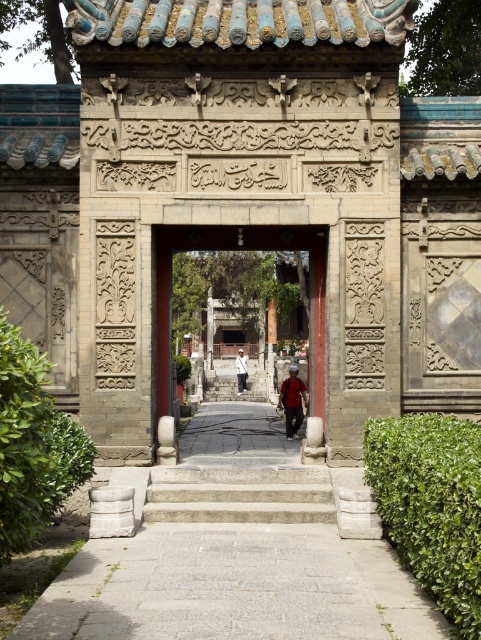
Who is positioned more to the left, green leafy hedge at right or smooth stone gate at center?

smooth stone gate at center

Based on the photo, which is above, green leafy hedge at right or smooth stone gate at center?

smooth stone gate at center is above.

Who is more distant from viewer, (463, 445) or (156, 364)?

Positioned behind is point (156, 364).

You are a GUI agent. You are given a task and a screenshot of the screen. Output one action in this format:
    pyautogui.click(x=<x>, y=<y>)
    Task: Click on the green leafy hedge at right
    The height and width of the screenshot is (640, 481).
    Given the screenshot: What is the action you would take?
    pyautogui.click(x=431, y=506)

Is the position of green leafy hedge at right less distant than that of gray stone stairs at center?

Yes, it is in front of gray stone stairs at center.

Can you confirm if green leafy hedge at right is shorter than gray stone stairs at center?

Indeed, green leafy hedge at right has a lesser height compared to gray stone stairs at center.

Is point (431, 500) positioned behind point (249, 520)?

That is False.

Where is `green leafy hedge at right`? green leafy hedge at right is located at coordinates (431, 506).

Is point (142, 611) farther from viewer compared to point (166, 246)?

No, it is in front of (166, 246).

Does point (155, 611) come in front of point (258, 248)?

That is True.

The height and width of the screenshot is (640, 481). I want to click on smooth stone pathway at center, so pyautogui.click(x=233, y=552).